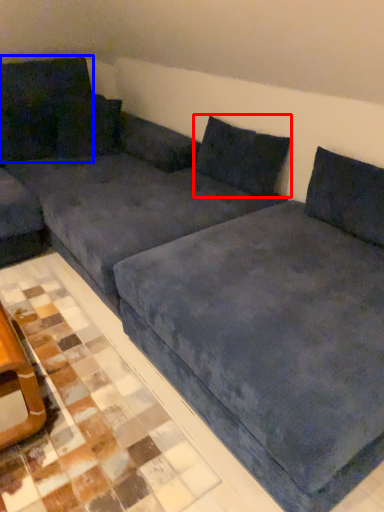
Question: Which object is closer to the camera taking this photo, pillow (highlighted by a red box) or pillow (highlighted by a blue box)?

Choices:
 (A) pillow
 (B) pillow

Answer: (A)